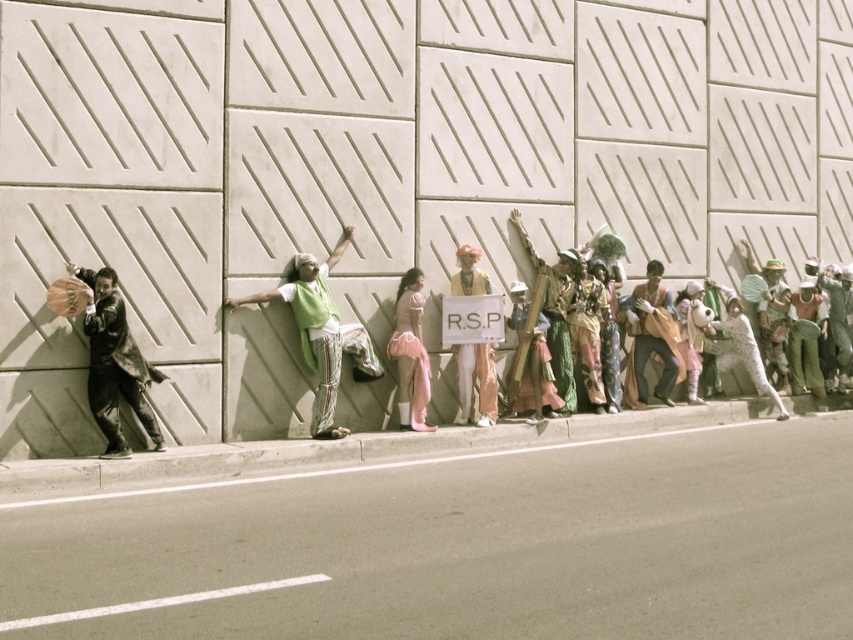
Does pink satin dress at center appear on the right side of white paper sign at center?

No, pink satin dress at center is not to the right of white paper sign at center.

In the scene shown: Is pink satin dress at center positioned in front of white paper sign at center?

Yes, pink satin dress at center is closer to the viewer.

This screenshot has height=640, width=853. Describe the element at coordinates (410, 353) in the screenshot. I see `pink satin dress at center` at that location.

Find the location of a particular element. pink satin dress at center is located at coordinates (410, 353).

Is white concrete wall at center taller than concrete at lower left?

Correct, white concrete wall at center is much taller as concrete at lower left.

Can you confirm if white concrete wall at center is smaller than concrete at lower left?

Actually, white concrete wall at center might be larger than concrete at lower left.

Where is `white concrete wall at center`? This screenshot has height=640, width=853. white concrete wall at center is located at coordinates (381, 168).

Locate an element on the screen. white concrete wall at center is located at coordinates (381, 168).

Does green fabric at center lie behind pink satin dress at center?

No.

Is green fabric at center wider than pink satin dress at center?

Yes, green fabric at center is wider than pink satin dress at center.

Measure the distance between point (328,378) and camera.

A distance of 14.61 meters exists between point (328,378) and camera.

Locate an element on the screen. Image resolution: width=853 pixels, height=640 pixels. green fabric at center is located at coordinates point(321,332).